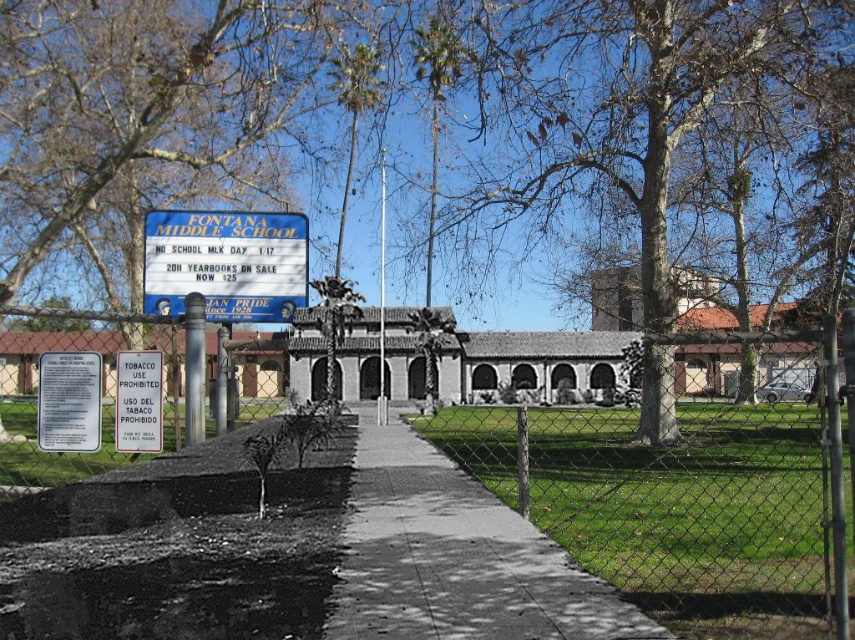
You are standing at the entrance of Fontana Middle School and want to take a photo of the school signboard. If you move forward by 20 feet, will the point at point (x=534, y=68) become closer to the camera?

The point at point (x=534, y=68) is currently 62.86 feet away from the camera. Moving forward by 20 feet would reduce the distance to 42.86 feet, so yes, the point at point (x=534, y=68) would become closer to the camera.